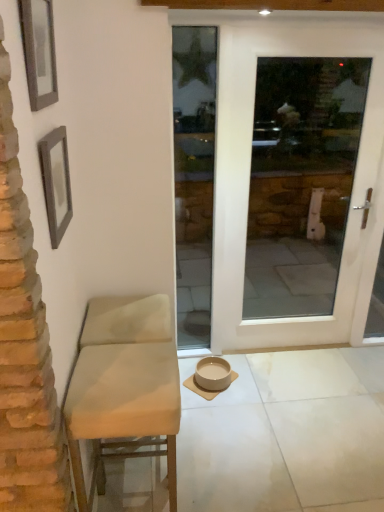
The image size is (384, 512). What are the coordinates of `vacant area on top of white glossy door at center (from a real-world perspective)` in the screenshot? It's located at pyautogui.click(x=320, y=28).